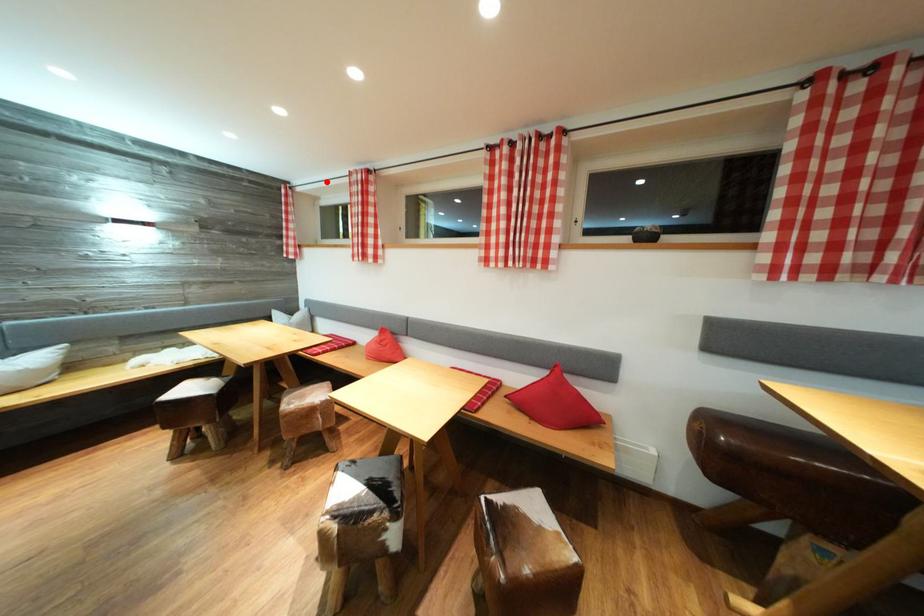
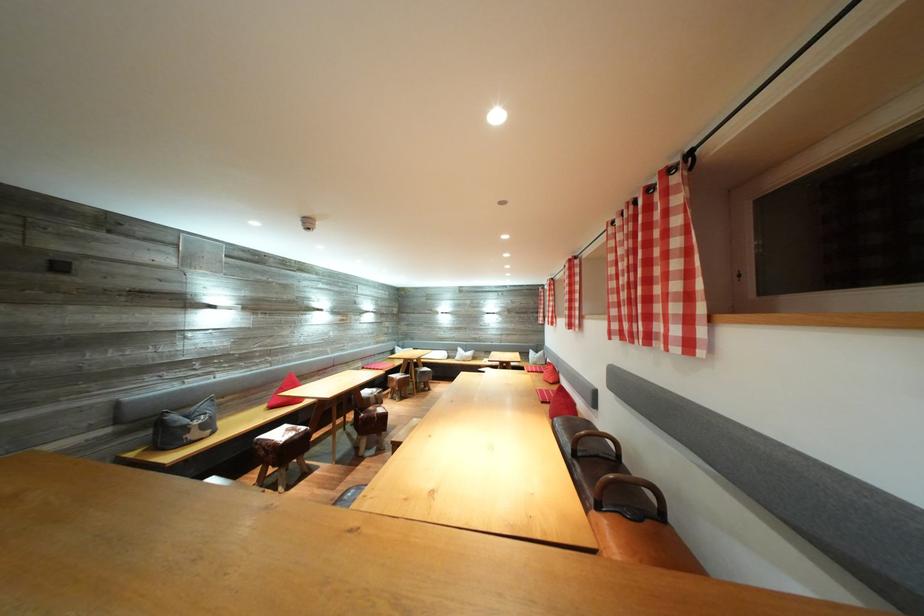
Question: A red point is marked in image1. In image2, is the corresponding 3D point closer to the camera or farther? Reply with the corresponding letter.

Choices:
 (A) The corresponding 3D point is closer.
 (B) The corresponding 3D point is farther.

Answer: (B)